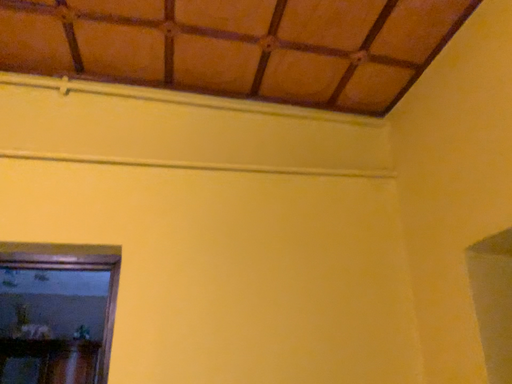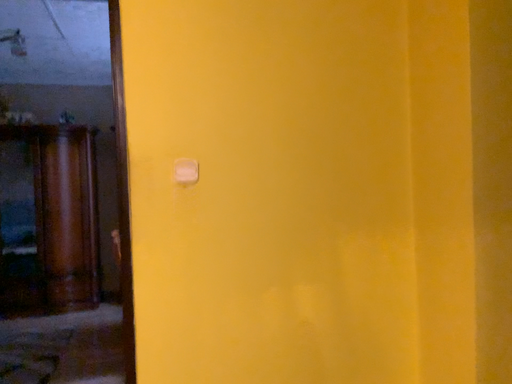
Question: How did the camera likely rotate when shooting the video?

Choices:
 (A) rotated upward
 (B) rotated downward

Answer: (B)